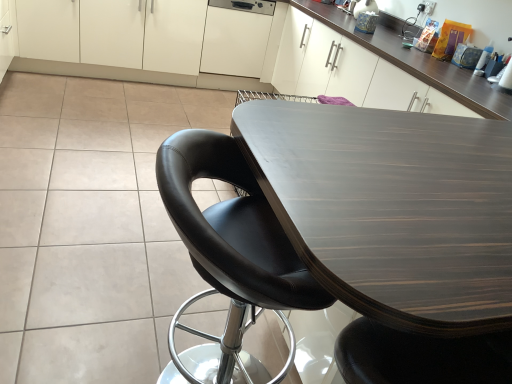
The image size is (512, 384). What are the coordinates of `free location above dark wood table at center (from a real-world perspective)` in the screenshot? It's located at (405, 167).